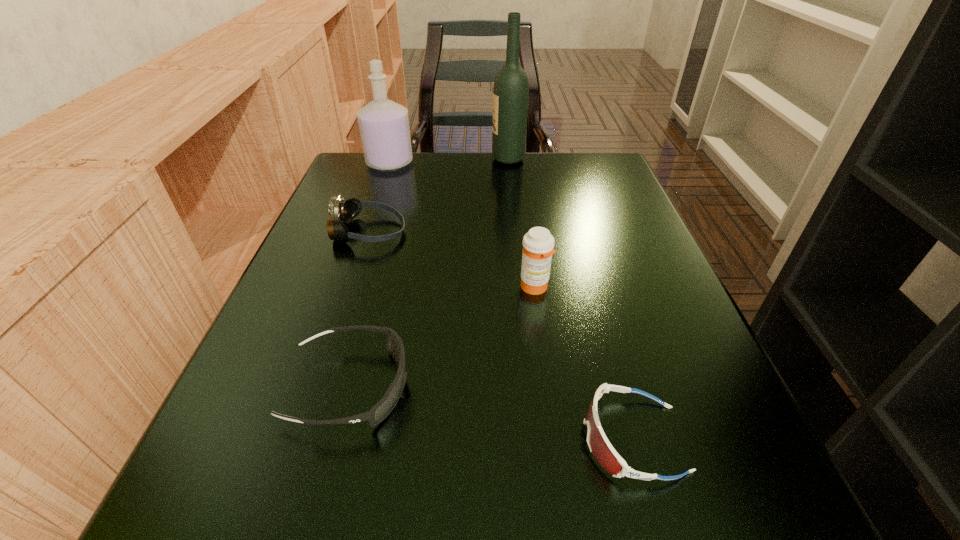
The height and width of the screenshot is (540, 960). Identify the location of free space located 0.200m on the back of the third nearest object. (524, 210).

In order to click on vacant area situated through the lenses of the farthest goggles in this screenshot , I will do `click(525, 231)`.

Find the location of a particular element. Image resolution: width=960 pixels, height=540 pixels. free space located 0.330m on the front-facing side of the rightmost object is located at coordinates (294, 438).

This screenshot has height=540, width=960. Find the location of `free space located 0.400m on the front-facing side of the rightmost object`. free space located 0.400m on the front-facing side of the rightmost object is located at coordinates (232, 438).

You are a GUI agent. You are given a task and a screenshot of the screen. Output one action in this format:
    pyautogui.click(x=<x>, y=<y>)
    Task: Click on the free space located 0.270m on the front-facing side of the rightmost object
    Image resolution: width=960 pixels, height=540 pixels.
    Given the screenshot: What is the action you would take?
    point(347,438)

Find the location of a particular element. The width and height of the screenshot is (960, 540). wine bottle present at the far edge is located at coordinates (511, 87).

At what (x,y) coordinates should I click in order to perform the action: click on perfume that is at the far edge. Please return your answer as a coordinate pair (x, y). Looking at the image, I should click on (384, 124).

This screenshot has width=960, height=540. What are the coordinates of `object at the near edge` in the screenshot? It's located at click(x=599, y=445).

Identify the location of perfume present at the left edge. [x=384, y=124].

Locate an element on the screen. The width and height of the screenshot is (960, 540). object that is at the right edge is located at coordinates (599, 445).